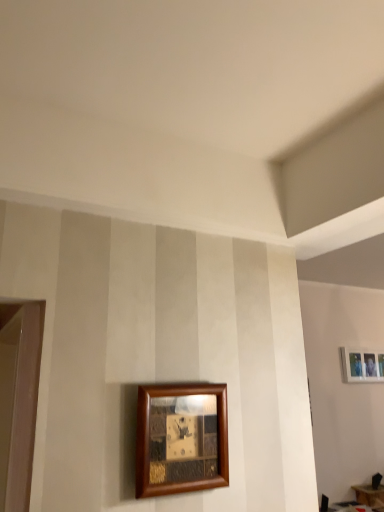
From the picture: How much space does wooden picture frame at lower center, marked as the 2th picture frame in a right-to-left arrangement, occupy vertically?

wooden picture frame at lower center, marked as the 2th picture frame in a right-to-left arrangement, is 10.05 inches in height.

In order to face white matte picture frame at upper right, placed as the first picture frame when sorted from back to front, should I rotate leftwards or rightwards?

Turn right approximately 22.315 degrees to face it.

Identify the location of wooden table at lower right. This screenshot has width=384, height=512. (370, 495).

Considering the relative positions of wooden picture frame at lower center, the first picture frame from the left, and wooden table at lower right in the image provided, is wooden picture frame at lower center, the first picture frame from the left, to the left or to the right of wooden table at lower right?

In the image, wooden picture frame at lower center, the first picture frame from the left, appears on the left side of wooden table at lower right.

Is point (149, 476) positioned before point (380, 500)?

That is True.

From the picture: From the image's perspective, would you say wooden picture frame at lower center, the first picture frame from the left, is shown under wooden table at lower right?

Actually, wooden picture frame at lower center, the first picture frame from the left, appears above wooden table at lower right in the image.

Is wooden table at lower right smaller than wooden picture frame at lower center, the first picture frame from the front?

Actually, wooden table at lower right might be larger than wooden picture frame at lower center, the first picture frame from the front.

From the image's perspective, is wooden table at lower right over wooden picture frame at lower center, which is the second picture frame in bottom-to-top order?

No, from the image's perspective, wooden table at lower right is not over wooden picture frame at lower center, which is the second picture frame in bottom-to-top order.

From a real-world perspective, is wooden table at lower right over wooden picture frame at lower center, the first picture frame from the left?

Incorrect, from a real-world perspective, wooden table at lower right is lower than wooden picture frame at lower center, the first picture frame from the left.

Is wooden table at lower right directly adjacent to wooden picture frame at lower center, the 1th picture frame when ordered from top to bottom?

No, wooden table at lower right is not making contact with wooden picture frame at lower center, the 1th picture frame when ordered from top to bottom.

Is point (378, 359) positioned before point (383, 502)?

No, (378, 359) is further to viewer.

Is white matte picture frame at upper right, which is counted as the second picture frame, starting from the top, directly adjacent to wooden table at lower right?

No.

Which object is closer to the camera, white matte picture frame at upper right, placed as the first picture frame when sorted from back to front, or wooden table at lower right?

wooden table at lower right is in front.

Between white matte picture frame at upper right, placed as the first picture frame when sorted from back to front, and wooden picture frame at lower center, the first picture frame from the left, which one is positioned in front?

wooden picture frame at lower center, the first picture frame from the left, is closer to the camera.

Considering the sizes of objects white matte picture frame at upper right, arranged as the 1th picture frame when viewed from the right, and wooden picture frame at lower center, marked as the 2th picture frame in a right-to-left arrangement, in the image provided, who is thinner, white matte picture frame at upper right, arranged as the 1th picture frame when viewed from the right, or wooden picture frame at lower center, marked as the 2th picture frame in a right-to-left arrangement,?

With smaller width is white matte picture frame at upper right, arranged as the 1th picture frame when viewed from the right.

Considering the relative positions of white matte picture frame at upper right, arranged as the 1th picture frame when viewed from the right, and wooden picture frame at lower center, the 1th picture frame when ordered from top to bottom, in the image provided, is white matte picture frame at upper right, arranged as the 1th picture frame when viewed from the right, to the right of wooden picture frame at lower center, the 1th picture frame when ordered from top to bottom, from the viewer's perspective?

Yes.

Would you say white matte picture frame at upper right, marked as the 2th picture frame in a left-to-right arrangement, contains wooden picture frame at lower center, marked as the 2th picture frame in a right-to-left arrangement?

No, wooden picture frame at lower center, marked as the 2th picture frame in a right-to-left arrangement, is not a part of white matte picture frame at upper right, marked as the 2th picture frame in a left-to-right arrangement.

Which object is further away from the camera, wooden table at lower right or white matte picture frame at upper right, the 1th picture frame in the bottom-to-top sequence?

Positioned behind is white matte picture frame at upper right, the 1th picture frame in the bottom-to-top sequence.

From a real-world perspective, which is physically above, wooden table at lower right or white matte picture frame at upper right, the second picture frame when ordered from front to back?

From a 3D spatial view, white matte picture frame at upper right, the second picture frame when ordered from front to back, is above.

Can you tell me how much wooden table at lower right and white matte picture frame at upper right, which is counted as the second picture frame, starting from the top, differ in facing direction?

0.914 degrees separate the facing orientations of wooden table at lower right and white matte picture frame at upper right, which is counted as the second picture frame, starting from the top.

Between wooden picture frame at lower center, the first picture frame from the left, and white matte picture frame at upper right, marked as the 2th picture frame in a left-to-right arrangement, which one is positioned in front?

wooden picture frame at lower center, the first picture frame from the left.

Is wooden picture frame at lower center, the 1th picture frame when ordered from top to bottom, spatially inside white matte picture frame at upper right, the 1th picture frame in the bottom-to-top sequence, or outside of it?

wooden picture frame at lower center, the 1th picture frame when ordered from top to bottom, is outside white matte picture frame at upper right, the 1th picture frame in the bottom-to-top sequence.

Who is bigger, wooden picture frame at lower center, which is the second picture frame in bottom-to-top order, or white matte picture frame at upper right, placed as the first picture frame when sorted from back to front?

Bigger between the two is white matte picture frame at upper right, placed as the first picture frame when sorted from back to front.

The height and width of the screenshot is (512, 384). I want to click on table below the wooden picture frame at lower center, the first picture frame from the left (from the image's perspective), so tap(370, 495).

This screenshot has width=384, height=512. I want to click on picture frame in front of the wooden table at lower right, so (181, 438).

Looking at the image, which one is located further to white matte picture frame at upper right, marked as the 2th picture frame in a left-to-right arrangement, wooden table at lower right or wooden picture frame at lower center, marked as the 2th picture frame in a right-to-left arrangement?

Among the two, wooden picture frame at lower center, marked as the 2th picture frame in a right-to-left arrangement, is located further to white matte picture frame at upper right, marked as the 2th picture frame in a left-to-right arrangement.

Which object lies further to the anchor point wooden table at lower right, white matte picture frame at upper right, which is counted as the second picture frame, starting from the top, or wooden picture frame at lower center, the first picture frame from the left?

The object further to wooden table at lower right is wooden picture frame at lower center, the first picture frame from the left.

Estimate the real-world distances between objects in this image. Which object is closer to wooden picture frame at lower center, marked as the 2th picture frame in a right-to-left arrangement, wooden table at lower right or white matte picture frame at upper right, the 1th picture frame in the bottom-to-top sequence?

white matte picture frame at upper right, the 1th picture frame in the bottom-to-top sequence.

Consider the image. When comparing their distances from wooden table at lower right, does wooden picture frame at lower center, the first picture frame from the front, or white matte picture frame at upper right, placed as the first picture frame when sorted from back to front, seem closer?

Based on the image, white matte picture frame at upper right, placed as the first picture frame when sorted from back to front, appears to be nearer to wooden table at lower right.

Looking at the image, which one is located closer to wooden picture frame at lower center, which is the second picture frame in bottom-to-top order, white matte picture frame at upper right, the second picture frame when ordered from front to back, or wooden table at lower right?

Based on the image, white matte picture frame at upper right, the second picture frame when ordered from front to back, appears to be nearer to wooden picture frame at lower center, which is the second picture frame in bottom-to-top order.

Looking at the image, which one is located closer to white matte picture frame at upper right, which is counted as the second picture frame, starting from the top, wooden picture frame at lower center, the second picture frame positioned from the back, or wooden table at lower right?

Based on the image, wooden table at lower right appears to be nearer to white matte picture frame at upper right, which is counted as the second picture frame, starting from the top.

Where is `table between wooden picture frame at lower center, the first picture frame from the left, and white matte picture frame at upper right, placed as the first picture frame when sorted from back to front, in the front-back direction`? table between wooden picture frame at lower center, the first picture frame from the left, and white matte picture frame at upper right, placed as the first picture frame when sorted from back to front, in the front-back direction is located at coordinates (370, 495).